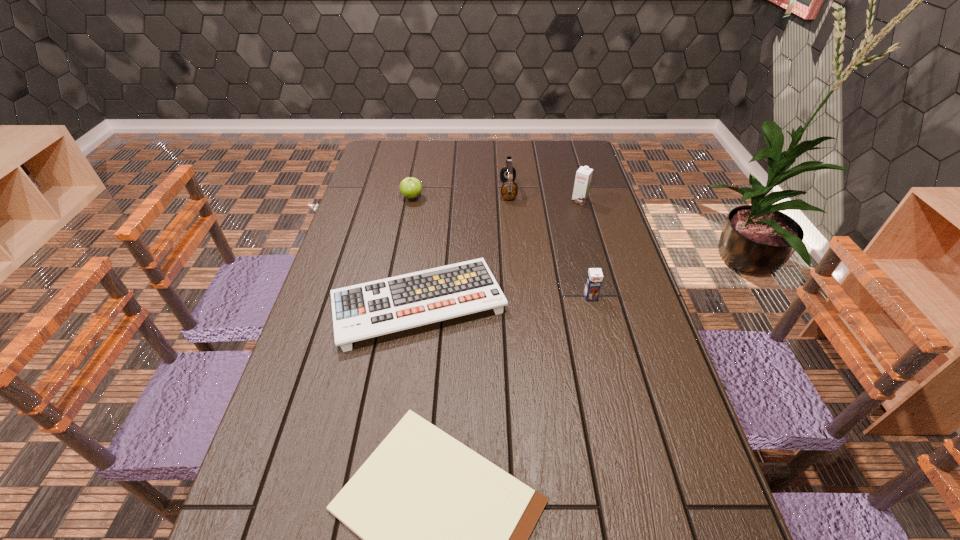
At what (x,y) coordinates should I click in order to perform the action: click on vacant space that is in between the fifth tallest object and the apple. Please return your answer as a coordinate pair (x, y). The image size is (960, 540). Looking at the image, I should click on (415, 250).

This screenshot has height=540, width=960. I want to click on vacant region between the headset and the taller chocolate milk, so click(543, 196).

Where is `free spot between the shorter chocolate milk and the headset`? The width and height of the screenshot is (960, 540). free spot between the shorter chocolate milk and the headset is located at coordinates (549, 244).

Locate an element on the screen. free point between the headset and the apple is located at coordinates (460, 194).

Find the location of a particular element. object that is the closest to the apple is located at coordinates (509, 189).

You are a GUI agent. You are given a task and a screenshot of the screen. Output one action in this format:
    pyautogui.click(x=<x>, y=<y>)
    Task: Click on the object identified as the closest to the farther chocolate milk
    
    Given the screenshot: What is the action you would take?
    pyautogui.click(x=509, y=189)

This screenshot has width=960, height=540. Identify the location of blank area in the image that satisfies the following two spatial constraints: 1. on the ear cups of the headset; 2. on the right side of the taller chocolate milk. (509, 201).

The width and height of the screenshot is (960, 540). What are the coordinates of `vacant space that satisfies the following two spatial constraints: 1. on the ear cups of the headset; 2. on the right side of the taller chocolate milk` in the screenshot? It's located at (509, 201).

Image resolution: width=960 pixels, height=540 pixels. What are the coordinates of `free location that satisfies the following two spatial constraints: 1. on the ear cups of the headset; 2. on the back side of the taller chocolate milk` in the screenshot? It's located at (509, 201).